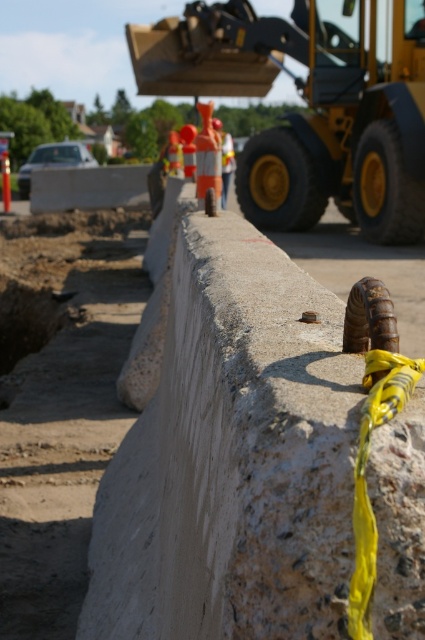
You are standing at point (x=308, y=108) in the construction site. What object are you standing on?

You are standing on the yellow rubber excavator at upper center located at point (x=308, y=108).

You are a safety inspector on a construction site. You need to ensure that the yellow rubber excavator at upper center and the orange reflective vest at center are placed in a way that allows for safe passage between them. Based on their sizes, which object should be moved to create more space?

The yellow rubber excavator at upper center occupies less space than the orange reflective vest at center, so the orange reflective vest at center should be moved to create more space.

You are a safety inspector at the construction site. You need to ensure that the orange reflective vest at center is visible to the operator of the yellow rubber excavator at upper center. Based on their positions, would the vest be in the operator s line of sight? Please explain your reasoning.

The yellow rubber excavator at upper center is positioned on the right side of the orange reflective vest at center. Since the excavator is to the right of the vest, the operator might have a clear line of sight to the vest depending on their vantage point. However, without knowing the exact angle or elevation of the operator, it is difficult to confirm visibility. Safety protocols should ensure the vest remains visible during operations.